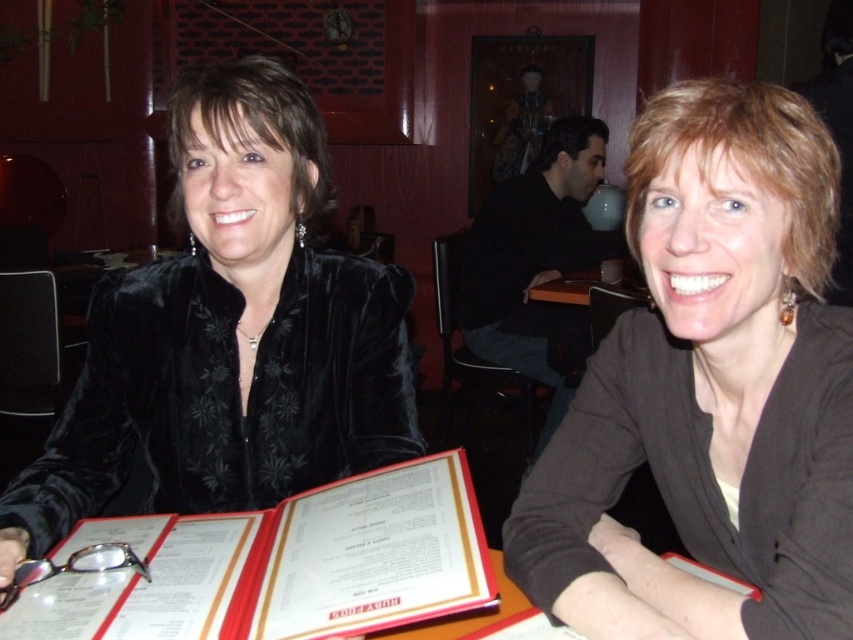
Question: Which point is farther to the camera?

Choices:
 (A) (842, 529)
 (B) (372, 476)
 (C) (216, 189)

Answer: (C)

Question: Based on their relative distances, which object is nearer to the velvet black jacket at left?

Choices:
 (A) white paper menu at center
 (B) brown matte jacket at center

Answer: (A)

Question: Does brown matte jacket at center have a greater width compared to white paper menu at center?

Choices:
 (A) yes
 (B) no

Answer: (B)

Question: Is velvet black jacket at left in front of white paper menu at center?

Choices:
 (A) no
 (B) yes

Answer: (A)

Question: Among these points, which one is farthest from the camera?

Choices:
 (A) (389, 580)
 (B) (672, 289)

Answer: (B)

Question: Does brown matte jacket at center come in front of white paper menu at center?

Choices:
 (A) yes
 (B) no

Answer: (A)